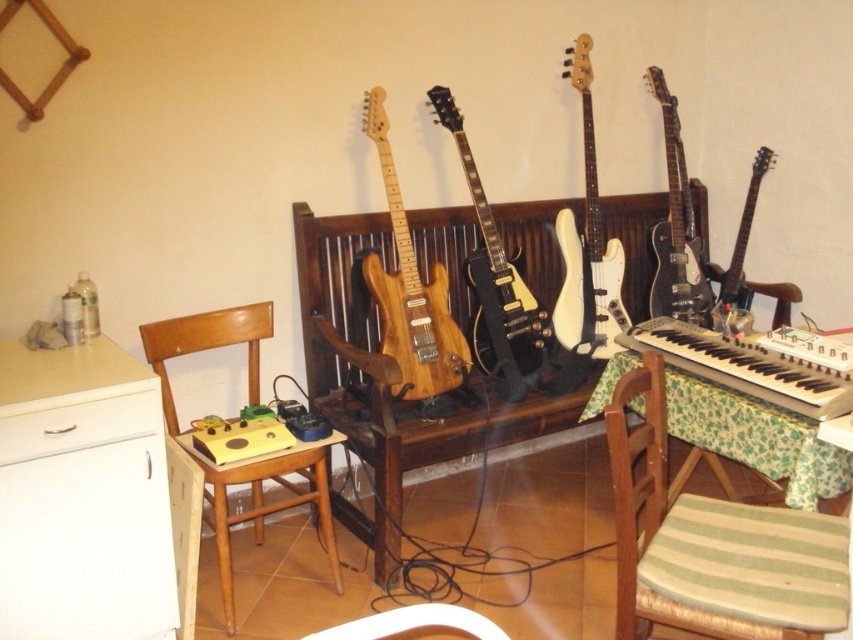
Question: Is green striped fabric chair at lower right positioned at the back of glossy black electric guitar at right?

Choices:
 (A) no
 (B) yes

Answer: (A)

Question: Is green striped fabric chair at lower right smaller than glossy black electric guitar at center?

Choices:
 (A) no
 (B) yes

Answer: (A)

Question: Can you confirm if natural wood electric guitar at center is positioned above glossy black electric guitar at upper right?

Choices:
 (A) no
 (B) yes

Answer: (A)

Question: Among these objects, which one is farthest from the camera?

Choices:
 (A) white plastic keyboard at right
 (B) glossy black electric guitar at center
 (C) white matte bass guitar at center
 (D) green striped fabric chair at lower right

Answer: (C)

Question: Based on their relative distances, which object is farther from the glossy black electric guitar at upper right?

Choices:
 (A) green striped fabric chair at lower right
 (B) white plastic keyboard at right

Answer: (A)

Question: Which of these objects is positioned closest to the white matte bass guitar at center?

Choices:
 (A) wooden chair at left
 (B) white plastic chair at lower center
 (C) green striped fabric chair at lower right

Answer: (C)